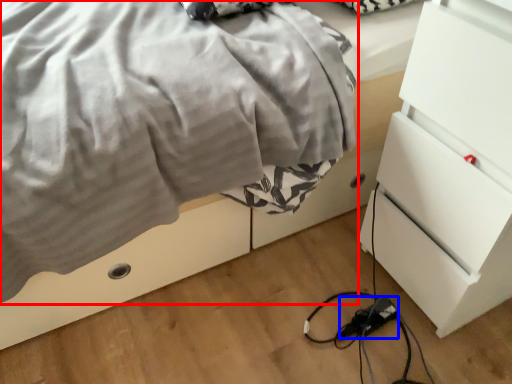
Question: Which of the following is the farthest to the observer, blanket (highlighted by a red box) or extension cord (highlighted by a blue box)?

Choices:
 (A) blanket
 (B) extension cord

Answer: (B)